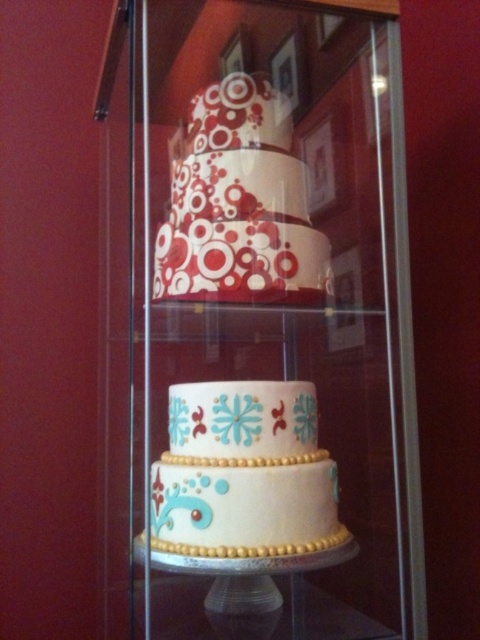
You are standing in front of the glass cabinet and want to place a gift card on the transparent glass cake stand at center. Where should you aim to place it?

The transparent glass cake stand at center is located at the 2D coordinates point (x=257, y=612), so you should aim for that exact point to place the gift card.

You are a baker who wants to place the white glossy glass plate at center under the matte red and white cake at center to catch any drips. Based on the scene description, will the plate be able to support the cake properly?

The matte red and white cake at center has a greater height compared to the white glossy glass plate at center, so the plate may not be tall enough to catch drips from the cake.

You are a customer looking at the cake display in the glass cabinet. You see the transparent glass cake stand at center and the white glossy glass plate at center. Which one is positioned to the right side of the other?

The transparent glass cake stand at center is to the right of the white glossy glass plate at center.